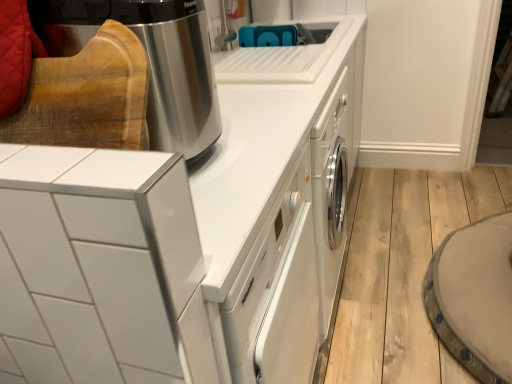
Question: From a real-world perspective, is white glossy dishwasher at center, arranged as the 1th home appliance when ordered from the bottom, positioned over white glossy cabinet at upper left, the 2th home appliance when ordered from top to bottom, based on gravity?

Choices:
 (A) no
 (B) yes

Answer: (A)

Question: Does white glossy dishwasher at center, arranged as the 1th home appliance when ordered from the bottom, have a greater width compared to white glossy cabinet at upper left, the 2th home appliance when ordered from top to bottom?

Choices:
 (A) no
 (B) yes

Answer: (B)

Question: Can you confirm if white glossy dishwasher at center, which is counted as the third home appliance, starting from the top, is thinner than white glossy cabinet at upper left, which ranks as the 2th home appliance in bottom-to-top order?

Choices:
 (A) yes
 (B) no

Answer: (B)

Question: Is the depth of white glossy dishwasher at center, which is counted as the third home appliance, starting from the top, greater than that of white glossy cabinet at upper left, the 2th home appliance when ordered from top to bottom?

Choices:
 (A) no
 (B) yes

Answer: (B)

Question: Does white glossy dishwasher at center, which is counted as the third home appliance, starting from the top, have a lesser height compared to white glossy cabinet at upper left, the 2th home appliance when ordered from top to bottom?

Choices:
 (A) yes
 (B) no

Answer: (B)

Question: Looking at the image, does white glossy dishwasher at center, arranged as the 1th home appliance when ordered from the bottom, seem bigger or smaller compared to white glossy cabinet at upper left, which ranks as the 2th home appliance in bottom-to-top order?

Choices:
 (A) small
 (B) big

Answer: (B)

Question: Looking at their shapes, would you say white glossy dishwasher at center, which is counted as the third home appliance, starting from the top, is wider or thinner than white glossy cabinet at upper left, the 2th home appliance when ordered from top to bottom?

Choices:
 (A) thin
 (B) wide

Answer: (B)

Question: Considering the positions of point (194, 362) and point (57, 190), is point (194, 362) closer or farther from the camera than point (57, 190)?

Choices:
 (A) closer
 (B) farther

Answer: (B)

Question: Relative to white glossy cabinet at upper left, which ranks as the 2th home appliance in bottom-to-top order, is white glossy dishwasher at center, which is counted as the third home appliance, starting from the top, in front or behind?

Choices:
 (A) behind
 (B) front

Answer: (A)

Question: Is stainless steel coffee maker at upper left, the first home appliance positioned from the top, wider or thinner than white glossy cabinet at upper left, the 2th home appliance when ordered from top to bottom?

Choices:
 (A) wide
 (B) thin

Answer: (A)

Question: From a real-world perspective, is stainless steel coffee maker at upper left, which ranks as the 3th home appliance in bottom-to-top order, above or below white glossy cabinet at upper left, which ranks as the 2th home appliance in bottom-to-top order?

Choices:
 (A) above
 (B) below

Answer: (A)

Question: Is stainless steel coffee maker at upper left, which ranks as the 3th home appliance in bottom-to-top order, situated inside white glossy cabinet at upper left, which ranks as the 2th home appliance in bottom-to-top order, or outside?

Choices:
 (A) outside
 (B) inside

Answer: (A)

Question: Is stainless steel coffee maker at upper left, which ranks as the 3th home appliance in bottom-to-top order, in front of or behind white glossy cabinet at upper left, which ranks as the 2th home appliance in bottom-to-top order, in the image?

Choices:
 (A) front
 (B) behind

Answer: (B)

Question: Is white glossy dishwasher at center, which is counted as the third home appliance, starting from the top, spatially inside stainless steel coffee maker at upper left, which ranks as the 3th home appliance in bottom-to-top order, or outside of it?

Choices:
 (A) inside
 (B) outside

Answer: (B)

Question: Would you say white glossy dishwasher at center, which is counted as the third home appliance, starting from the top, is to the left or to the right of stainless steel coffee maker at upper left, the first home appliance positioned from the top, in the picture?

Choices:
 (A) left
 (B) right

Answer: (B)